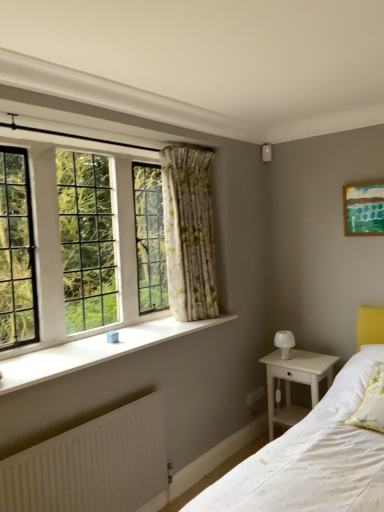
Question: Considering their positions, is white textured radiator at lower left located in front of or behind white soft pillow at lower right?

Choices:
 (A) behind
 (B) front

Answer: (B)

Question: Is white textured radiator at lower left to the left or to the right of white soft pillow at lower right in the image?

Choices:
 (A) right
 (B) left

Answer: (B)

Question: Which is farther from the clear glass windows at upper left?

Choices:
 (A) white textured radiator at lower left
 (B) floral fabric curtain at center
 (C) green textured canvas at upper right
 (D) white soft pillow at lower right
 (E) white smooth window sill at lower left

Answer: (D)

Question: Which of these objects is positioned closest to the floral fabric curtain at center?

Choices:
 (A) white smooth window sill at lower left
 (B) white soft pillow at lower right
 (C) green textured canvas at upper right
 (D) clear glass windows at upper left
 (E) white wood nightstand at lower right

Answer: (D)